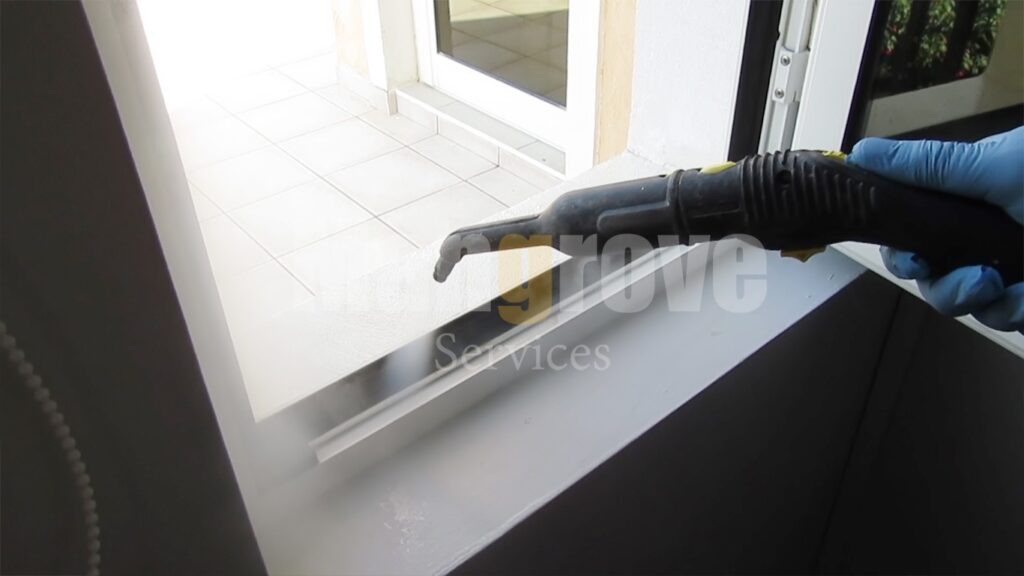
Locate an element on the screen. This screenshot has height=576, width=1024. window frame is located at coordinates (452, 377).